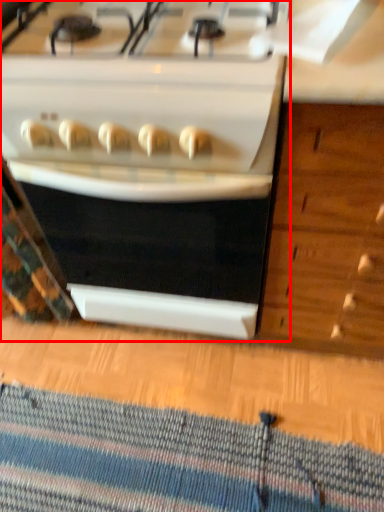
Question: Considering the relative positions of kitchen appliance (annotated by the red box) and doormat in the image provided, where is kitchen appliance (annotated by the red box) located with respect to the staircase?

Choices:
 (A) right
 (B) left

Answer: (A)